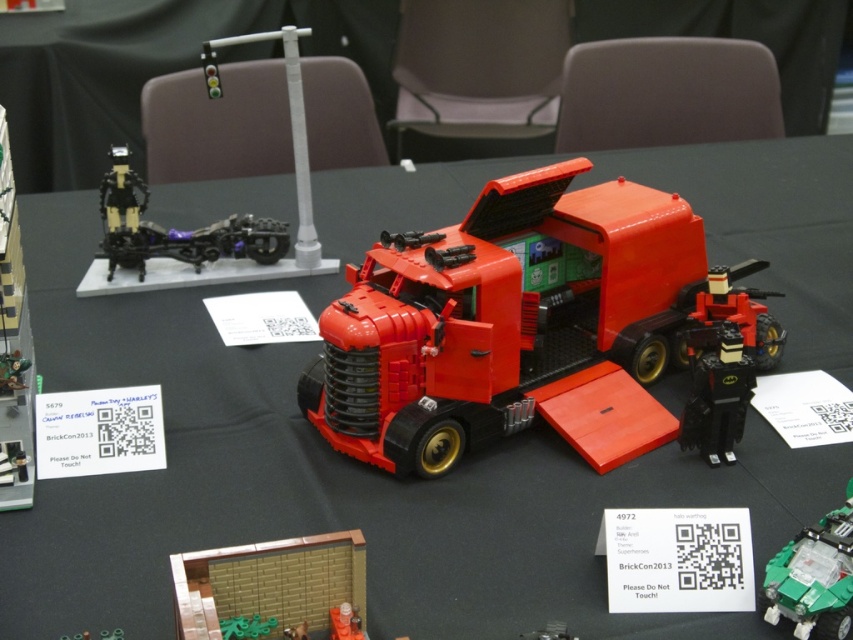
Question: Is black plastic motorcycle at upper left below metallic silver spaceship at center?

Choices:
 (A) no
 (B) yes

Answer: (A)

Question: Which point is closer to the camera?

Choices:
 (A) brick wall at center
 (B) metallic silver spaceship at center
 (C) black plastic motorcycle at upper left

Answer: (A)

Question: Does brick wall at center lie in front of orange matte truck at center?

Choices:
 (A) no
 (B) yes

Answer: (B)

Question: Which point is closer to the camera taking this photo?

Choices:
 (A) (689, 436)
 (B) (274, 609)

Answer: (B)

Question: Does brick wall at center have a greater width compared to black plastic batman figure at lower right?

Choices:
 (A) no
 (B) yes

Answer: (B)

Question: Among these points, which one is farthest from the camera?

Choices:
 (A) pyautogui.click(x=844, y=580)
 (B) pyautogui.click(x=184, y=636)
 (C) pyautogui.click(x=274, y=227)

Answer: (C)